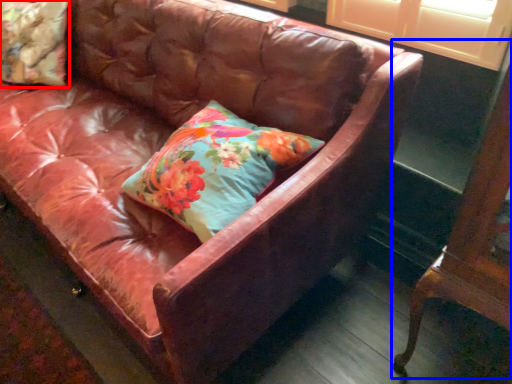
Question: Which point is further to the camera, pillow (highlighted by a red box) or furniture (highlighted by a blue box)?

Choices:
 (A) pillow
 (B) furniture

Answer: (A)